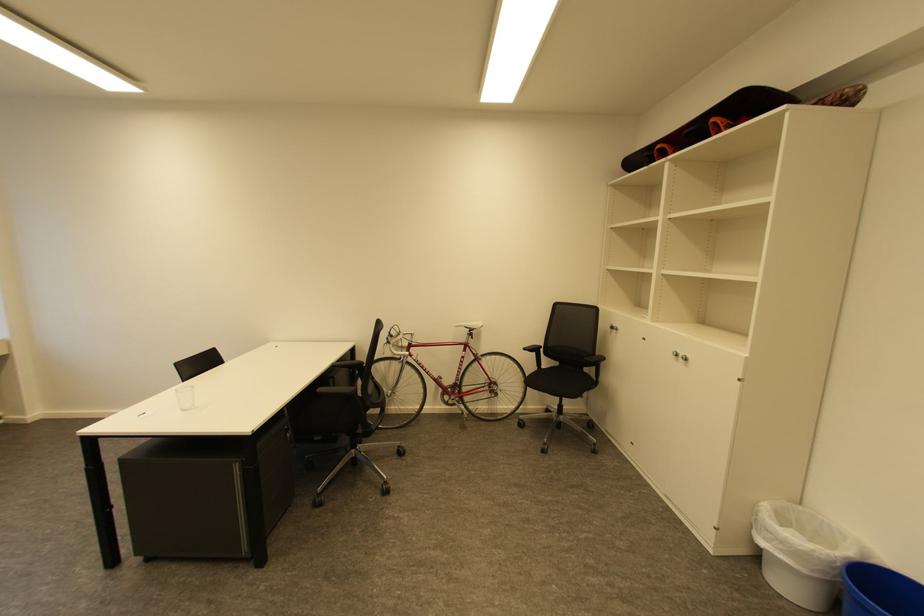
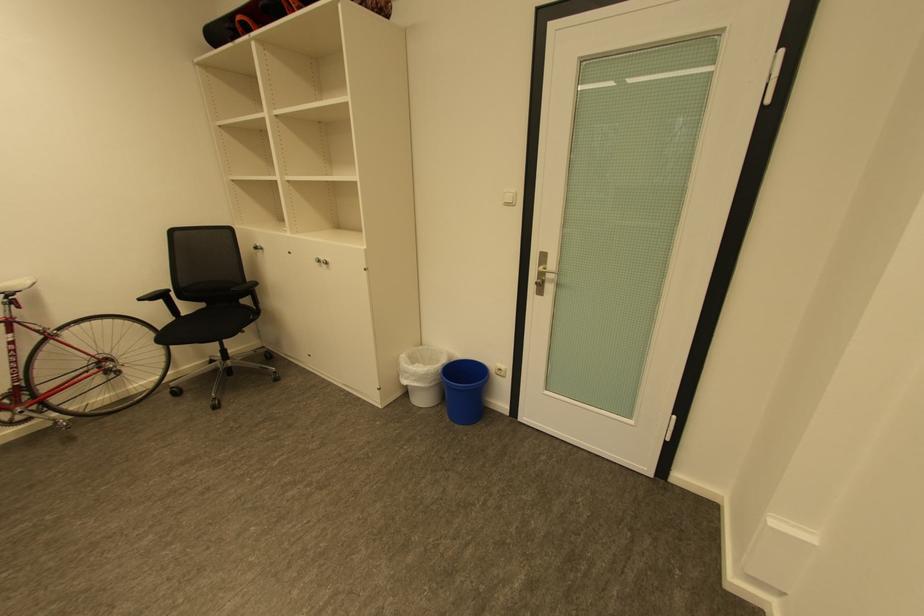
The point at (x=618, y=329) is marked in the first image. Where is the corresponding point in the second image?

(262, 248)